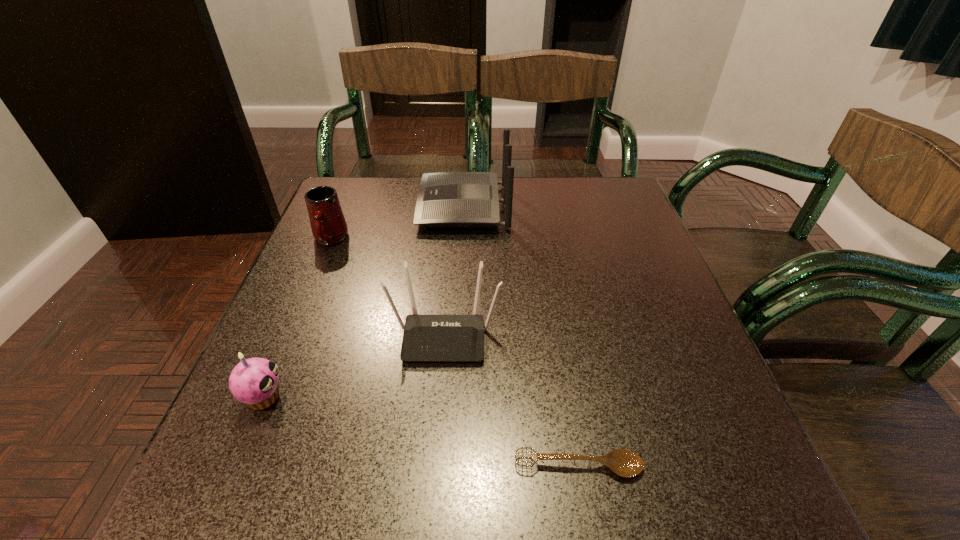
Find the location of `vacant space situated on the front-facing side of the tallest object`. vacant space situated on the front-facing side of the tallest object is located at coordinates (400, 206).

At what (x,y) coordinates should I click in order to perform the action: click on vacant space located on the front-facing side of the shorter router. Please return your answer as a coordinate pair (x, y). This screenshot has height=540, width=960. Looking at the image, I should click on (433, 486).

This screenshot has width=960, height=540. I want to click on free region located on the side of the mug with the handle, so click(x=274, y=377).

This screenshot has height=540, width=960. I want to click on blank space located 0.180m on the face of the fourth farthest object, so click(x=393, y=397).

Identify the location of free location located on the back of the shortest object. (549, 292).

Identify the location of object present at the far edge. The width and height of the screenshot is (960, 540). (445, 199).

At what (x,y) coordinates should I click in order to perform the action: click on object that is at the near edge. Please return your answer as a coordinate pair (x, y). Image resolution: width=960 pixels, height=540 pixels. Looking at the image, I should click on point(625,463).

Identify the location of mug located in the left edge section of the desktop. (328, 224).

Where is `cupcake situated at the left edge`? cupcake situated at the left edge is located at coordinates (254, 381).

Identify the location of vacant space at the far edge of the desktop. (560, 224).